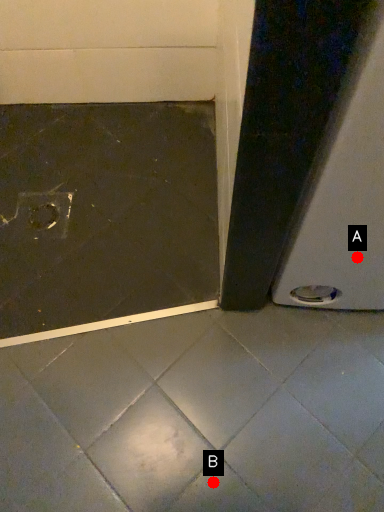
Question: Two points are circled on the image, labeled by A and B beside each circle. Which of the following is the farthest from the observer?

Choices:
 (A) A is further
 (B) B is further

Answer: (B)